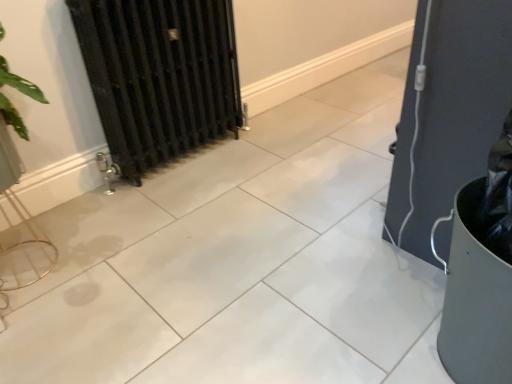
At what (x,y) coordinates should I click in order to perform the action: click on free space behind matte black guitar case at right. Please return your answer as a coordinate pair (x, y). Looking at the image, I should click on (369, 166).